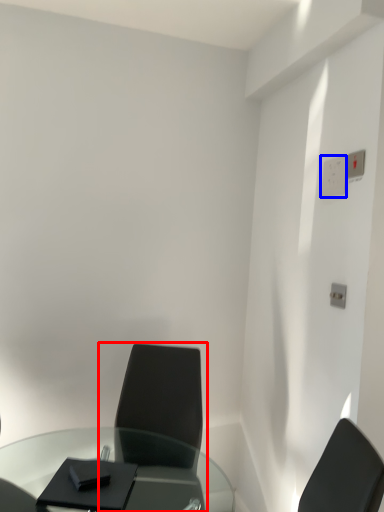
Question: Which object is further to the camera taking this photo, chair (highlighted by a red box) or electric outlet (highlighted by a blue box)?

Choices:
 (A) chair
 (B) electric outlet

Answer: (B)